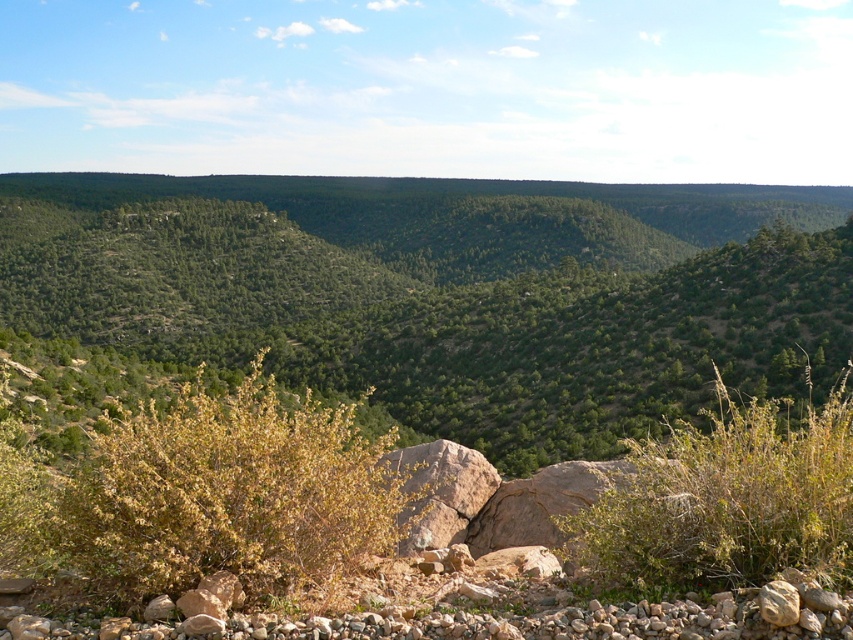
You are a hiker trying to navigate through the rocky terrain in the foreground. You notice a brown dry bush at lower left and a green leafy bush at center. Which bush would you choose to step around if you want to avoid the wider one?

The green leafy bush at center is wider, so you should step around the brown dry bush at lower left to avoid the wider one.

You are a hiker navigating the rocky terrain and want to reach the green leafy bush at center. Which direction should you move from the brown dry bush at lower left to get there?

You should move to the right from the brown dry bush at lower left to reach the green leafy bush at center since the brown dry bush at lower left is to the left of the green leafy bush at center.